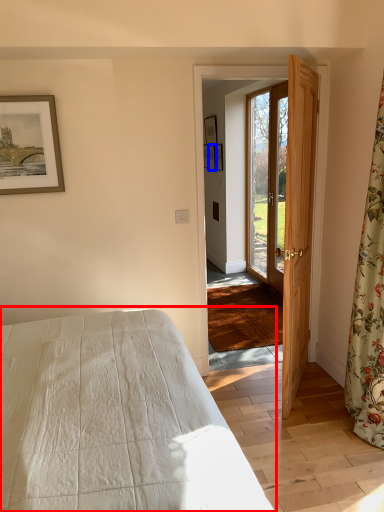
Question: Which object is closer to the camera taking this photo, bed (highlighted by a red box) or picture frame (highlighted by a blue box)?

Choices:
 (A) bed
 (B) picture frame

Answer: (A)